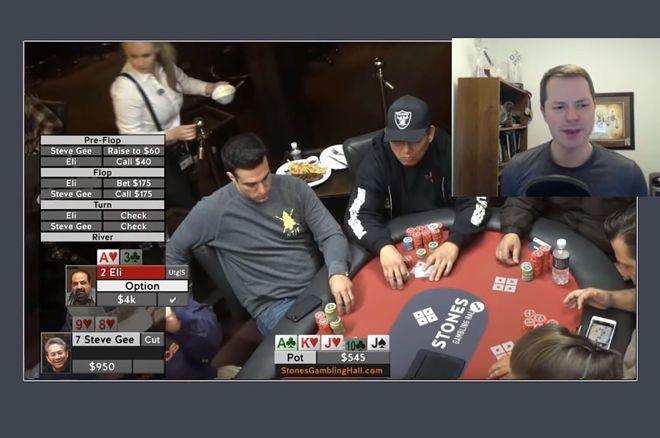
Identify the location of poker table. (484, 270).